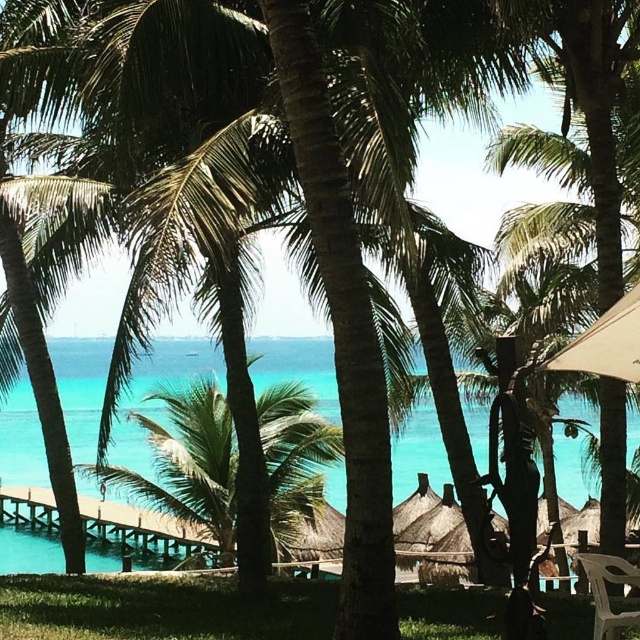
Which is more to the right, turquoise water at center or white plastic chair at lower right?

Positioned to the right is white plastic chair at lower right.

Can you confirm if turquoise water at center is positioned above white plastic chair at lower right?

No, turquoise water at center is not above white plastic chair at lower right.

This screenshot has height=640, width=640. Describe the element at coordinates (20, 440) in the screenshot. I see `turquoise water at center` at that location.

The height and width of the screenshot is (640, 640). I want to click on turquoise water at center, so click(20, 440).

Can you confirm if turquoise water at center is positioned to the left of beige fabric umbrella at right?

Indeed, turquoise water at center is positioned on the left side of beige fabric umbrella at right.

I want to click on turquoise water at center, so click(20, 440).

The image size is (640, 640). I want to click on turquoise water at center, so [x=20, y=440].

Is green leafy palm tree at center smaller than turquoise water at center?

Indeed, green leafy palm tree at center has a smaller size compared to turquoise water at center.

Does green leafy palm tree at center appear on the left side of turquoise water at center?

No, green leafy palm tree at center is not to the left of turquoise water at center.

Is point (230, 499) positioned before point (557, 481)?

Yes, it is in front of point (557, 481).

Where is `green leafy palm tree at center`? green leafy palm tree at center is located at coordinates (188, 464).